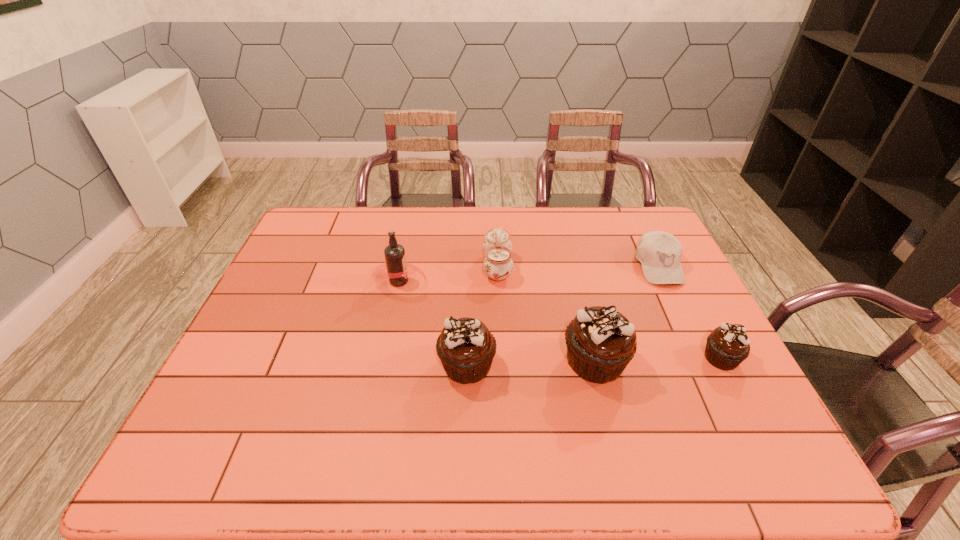
Please point out where to position a new cupcake on the left to maintain spacing. Please provide its 2D coordinates. Your answer should be formatted as a tuple, i.e. [(x, y)], where the tuple contains the x and y coordinates of a point satisfying the conditions above.

[(337, 368)]